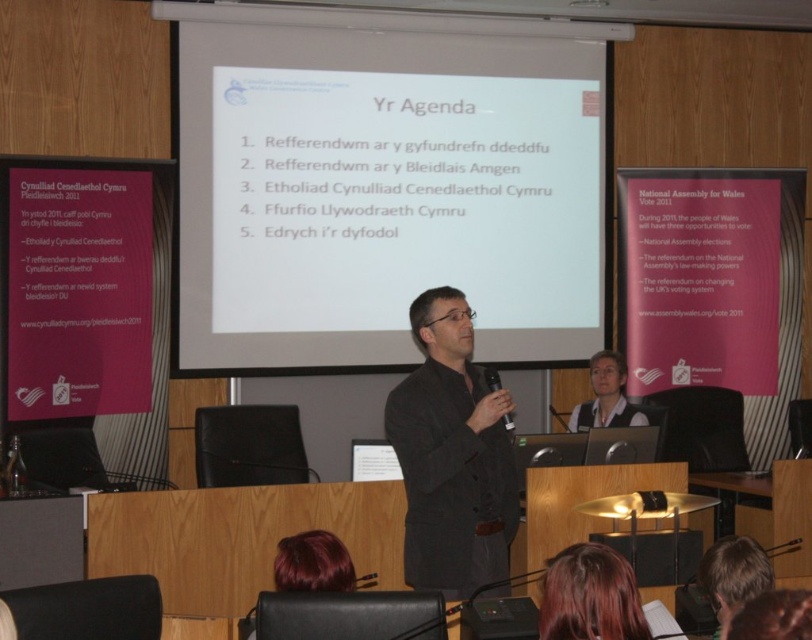
Question: Which point is farther to the camera?

Choices:
 (A) matte black shirt at center
 (B) smooth hair at lower center
 (C) dark gray suit at center

Answer: (A)

Question: Which point appears closest to the camera in this image?

Choices:
 (A) coord(471,474)
 (B) coord(642,419)

Answer: (A)

Question: Among these points, which one is nearest to the camera?

Choices:
 (A) (491, 554)
 (B) (644, 627)
 (C) (774, 605)

Answer: (C)

Question: Is dark gray suit at center further to the viewer compared to smooth hair at lower center?

Choices:
 (A) yes
 (B) no

Answer: (A)

Question: Is dark gray suit at center closer to the viewer compared to blonde hair at lower right?

Choices:
 (A) no
 (B) yes

Answer: (A)

Question: Is smooth hair at lower center positioned behind matte black shirt at center?

Choices:
 (A) no
 (B) yes

Answer: (A)